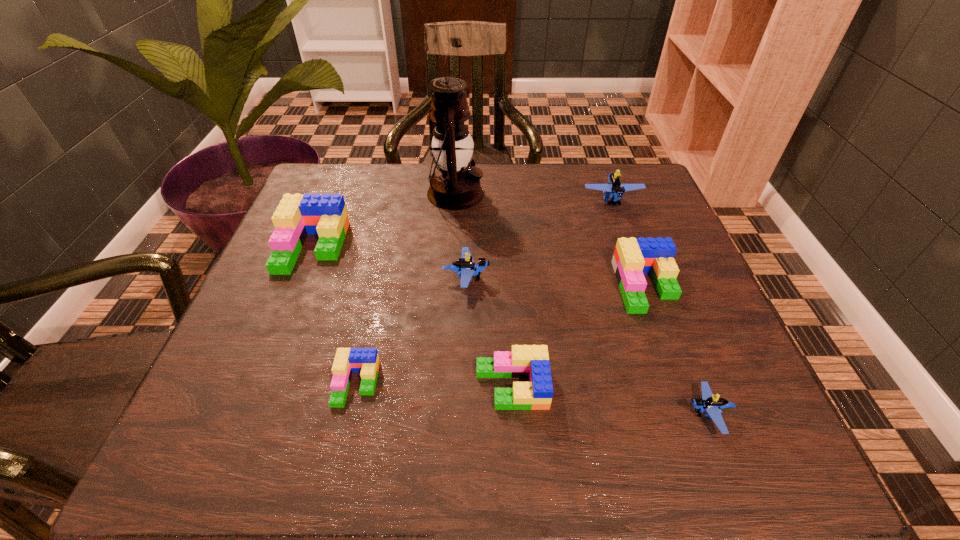
Locate an element on the screen. free location at the near edge is located at coordinates (288, 465).

Locate an element on the screen. vacant space at the left edge of the desktop is located at coordinates (278, 308).

This screenshot has height=540, width=960. In the image, there is a desktop. Identify the location of free space at the right edge. (719, 322).

In the image, there is a desktop. At what (x,y) coordinates should I click in order to perform the action: click on vacant space at the far left corner. Please return your answer as a coordinate pair (x, y). The width and height of the screenshot is (960, 540). Looking at the image, I should click on (346, 164).

In the image, there is a desktop. At what (x,y) coordinates should I click in order to perform the action: click on free space at the near left corner. Please return your answer as a coordinate pair (x, y). Image resolution: width=960 pixels, height=540 pixels. Looking at the image, I should click on (223, 437).

This screenshot has width=960, height=540. I want to click on free space between the smallest blue Lego and the rightmost green Lego, so click(677, 350).

Locate an element on the screen. This screenshot has height=540, width=960. vacant area that lies between the smallest blue Lego and the third green Lego from left to right is located at coordinates (610, 400).

Where is `free point between the second nearest blue Lego and the shortest object`? The image size is (960, 540). free point between the second nearest blue Lego and the shortest object is located at coordinates (411, 331).

I want to click on free space between the lantern and the second nearest blue Lego, so click(461, 236).

Where is `free space between the nearest blue Lego and the lantern`? The image size is (960, 540). free space between the nearest blue Lego and the lantern is located at coordinates (582, 304).